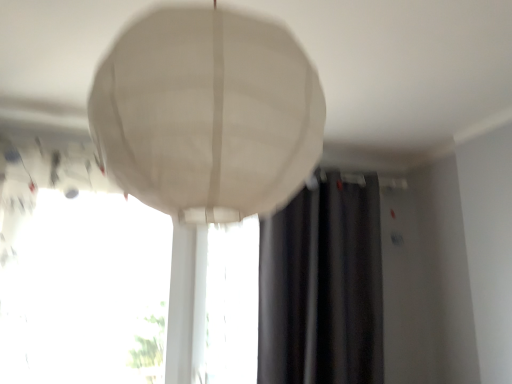
Question: From a real-world perspective, does dark gray fabric curtain at center stand above transparent glass window at center, the second window when ordered from left to right?

Choices:
 (A) yes
 (B) no

Answer: (A)

Question: From a real-world perspective, is dark gray fabric curtain at center located beneath transparent glass window at center, the second window when ordered from left to right?

Choices:
 (A) no
 (B) yes

Answer: (A)

Question: Does dark gray fabric curtain at center have a greater width compared to transparent glass window at center, the second window when ordered from left to right?

Choices:
 (A) no
 (B) yes

Answer: (B)

Question: Is dark gray fabric curtain at center placed right next to transparent glass window at center, the first window from the right?

Choices:
 (A) yes
 (B) no

Answer: (B)

Question: Could you tell me if dark gray fabric curtain at center is facing transparent glass window at center, the first window from the right?

Choices:
 (A) yes
 (B) no

Answer: (A)

Question: Based on their sizes in the image, would you say transparent glass window at center, the second window when ordered from left to right, is bigger or smaller than dark gray fabric curtain at center?

Choices:
 (A) small
 (B) big

Answer: (A)

Question: Based on their positions, is transparent glass window at center, the first window from the right, located to the left or right of dark gray fabric curtain at center?

Choices:
 (A) right
 (B) left

Answer: (B)

Question: Looking at their shapes, would you say transparent glass window at center, the second window when ordered from left to right, is wider or thinner than dark gray fabric curtain at center?

Choices:
 (A) wide
 (B) thin

Answer: (B)

Question: Does point (249, 365) appear closer or farther from the camera than point (370, 301)?

Choices:
 (A) farther
 (B) closer

Answer: (B)

Question: From a real-world perspective, relative to transparent glass window at center, which ranks as the second window in right-to-left order, is transparent glass window at center, the first window from the right, vertically above or below?

Choices:
 (A) below
 (B) above

Answer: (A)

Question: Is transparent glass window at center, the second window when ordered from left to right, in front of or behind transparent glass window at center, which ranks as the first window in left-to-right order, in the image?

Choices:
 (A) front
 (B) behind

Answer: (B)

Question: Considering the positions of transparent glass window at center, the first window from the right, and transparent glass window at center, which ranks as the second window in right-to-left order, in the image, is transparent glass window at center, the first window from the right, taller or shorter than transparent glass window at center, which ranks as the second window in right-to-left order,?

Choices:
 (A) tall
 (B) short

Answer: (B)

Question: Is point (254, 355) positioned closer to the camera than point (98, 196)?

Choices:
 (A) closer
 (B) farther

Answer: (B)

Question: From a real-world perspective, is dark gray fabric curtain at center above or below transparent glass window at center, the second window when ordered from left to right?

Choices:
 (A) below
 (B) above

Answer: (B)

Question: Based on their sizes in the image, would you say dark gray fabric curtain at center is bigger or smaller than transparent glass window at center, the first window from the right?

Choices:
 (A) small
 (B) big

Answer: (B)